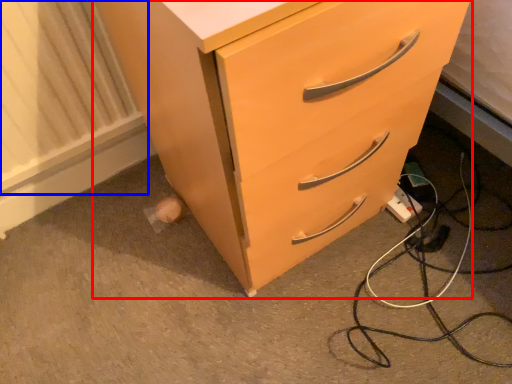
Question: Which object appears farthest to the camera in this image, chest of drawers (highlighted by a red box) or radiator (highlighted by a blue box)?

Choices:
 (A) chest of drawers
 (B) radiator

Answer: (B)